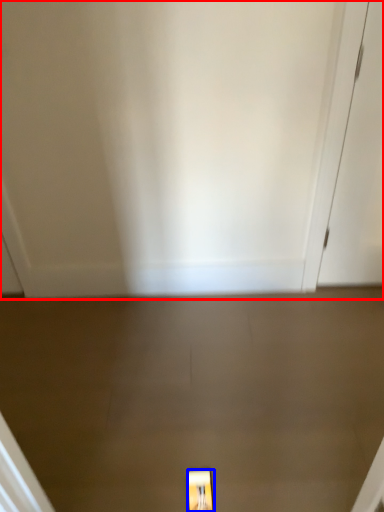
Question: Which object appears closest to the camera in this image, door (highlighted by a red box) or light fixture (highlighted by a blue box)?

Choices:
 (A) door
 (B) light fixture

Answer: (A)